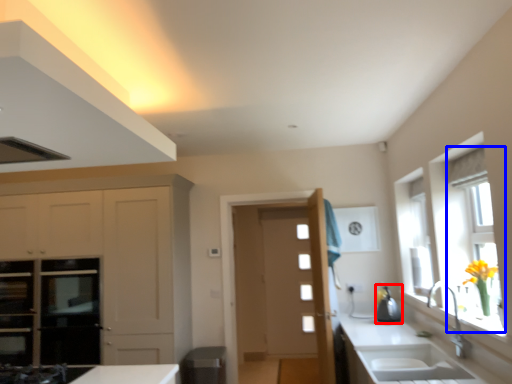
Question: Among these objects, which one is nearest to the camera, appliance (highlighted by a red box) or window (highlighted by a blue box)?

Choices:
 (A) appliance
 (B) window

Answer: (B)